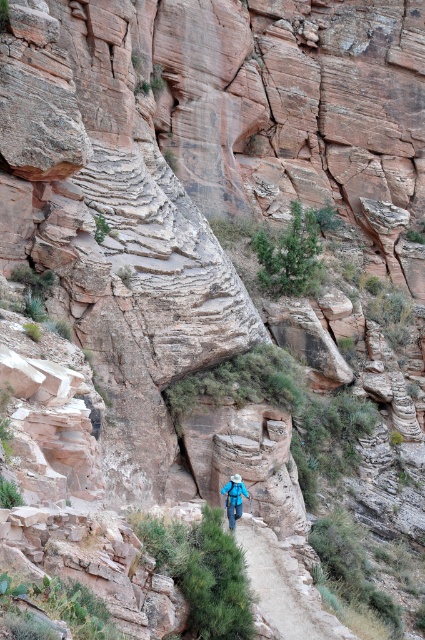
Looking at this image, can you confirm if dirt path at center is positioned to the left of blue fabric backpack at center?

In fact, dirt path at center is to the right of blue fabric backpack at center.

Looking at this image, who is positioned more to the left, dirt path at center or blue fabric backpack at center?

blue fabric backpack at center is more to the left.

Is point (283, 573) positioned after point (238, 488)?

No, it is not.

This screenshot has height=640, width=425. I want to click on dirt path at center, so click(x=283, y=588).